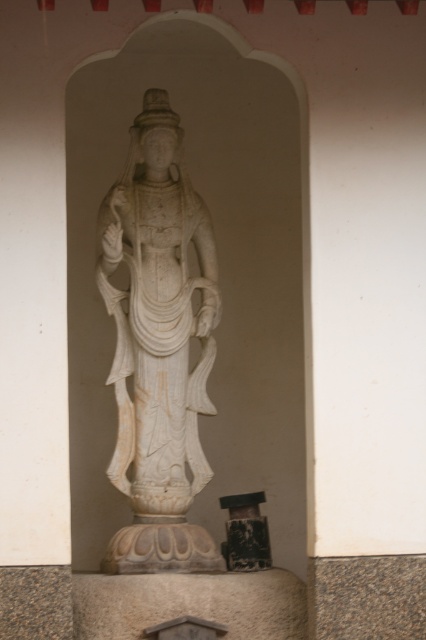
Is white marble statue at center in front of black textured pillar at center?

Yes, it is.

What do you see at coordinates (158, 348) in the screenshot? This screenshot has width=426, height=640. I see `white marble statue at center` at bounding box center [158, 348].

The image size is (426, 640). What do you see at coordinates (158, 348) in the screenshot?
I see `white marble statue at center` at bounding box center [158, 348].

I want to click on white marble statue at center, so click(158, 348).